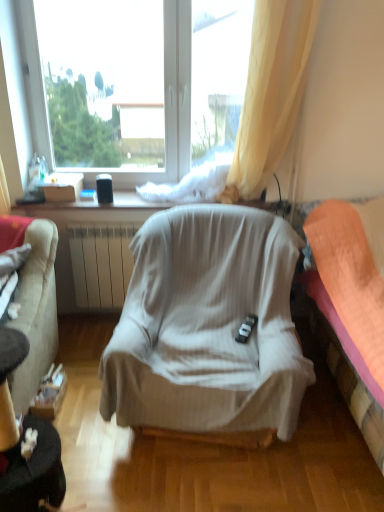
Question: Is orange fabric bed at right with white cardboard box at upper left?

Choices:
 (A) no
 (B) yes

Answer: (A)

Question: Considering the relative positions of orange fabric bed at right and white cardboard box at upper left in the image provided, is orange fabric bed at right to the right of white cardboard box at upper left from the viewer's perspective?

Choices:
 (A) no
 (B) yes

Answer: (B)

Question: Can we say orange fabric bed at right lies outside white cardboard box at upper left?

Choices:
 (A) yes
 (B) no

Answer: (A)

Question: Is orange fabric bed at right wider than white cardboard box at upper left?

Choices:
 (A) yes
 (B) no

Answer: (A)

Question: Can you confirm if orange fabric bed at right is shorter than white cardboard box at upper left?

Choices:
 (A) yes
 (B) no

Answer: (B)

Question: Relative to white cardboard box at upper left, is velvet beige couch at left in front or behind?

Choices:
 (A) behind
 (B) front

Answer: (B)

Question: From a real-world perspective, is velvet beige couch at left positioned above or below white cardboard box at upper left?

Choices:
 (A) below
 (B) above

Answer: (A)

Question: From their relative heights in the image, would you say velvet beige couch at left is taller or shorter than white cardboard box at upper left?

Choices:
 (A) short
 (B) tall

Answer: (B)

Question: Considering the positions of velvet beige couch at left and white cardboard box at upper left in the image, is velvet beige couch at left bigger or smaller than white cardboard box at upper left?

Choices:
 (A) big
 (B) small

Answer: (A)

Question: Would you say velvet beige couch at left is inside or outside light beige fabric chair at center?

Choices:
 (A) inside
 (B) outside

Answer: (B)

Question: From a real-world perspective, is velvet beige couch at left positioned above or below light beige fabric chair at center?

Choices:
 (A) below
 (B) above

Answer: (B)

Question: Based on their sizes in the image, would you say velvet beige couch at left is bigger or smaller than light beige fabric chair at center?

Choices:
 (A) big
 (B) small

Answer: (B)

Question: Is velvet beige couch at left wider or thinner than light beige fabric chair at center?

Choices:
 (A) thin
 (B) wide

Answer: (A)

Question: Considering the positions of white matte window at upper center and orange fabric bed at right in the image, is white matte window at upper center bigger or smaller than orange fabric bed at right?

Choices:
 (A) big
 (B) small

Answer: (B)

Question: Is white matte window at upper center spatially inside orange fabric bed at right, or outside of it?

Choices:
 (A) inside
 (B) outside

Answer: (B)